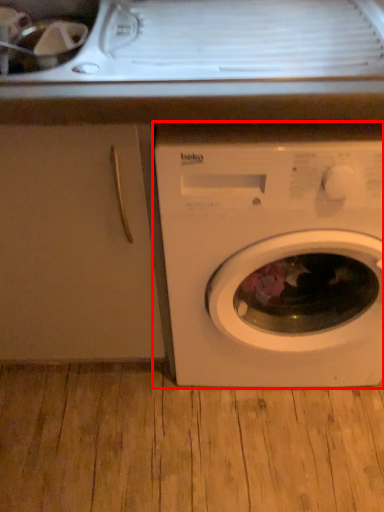
Question: From the image's perspective, what is the correct spatial positioning of washing machine (annotated by the red box) in reference to screen door?

Choices:
 (A) below
 (B) above

Answer: (A)